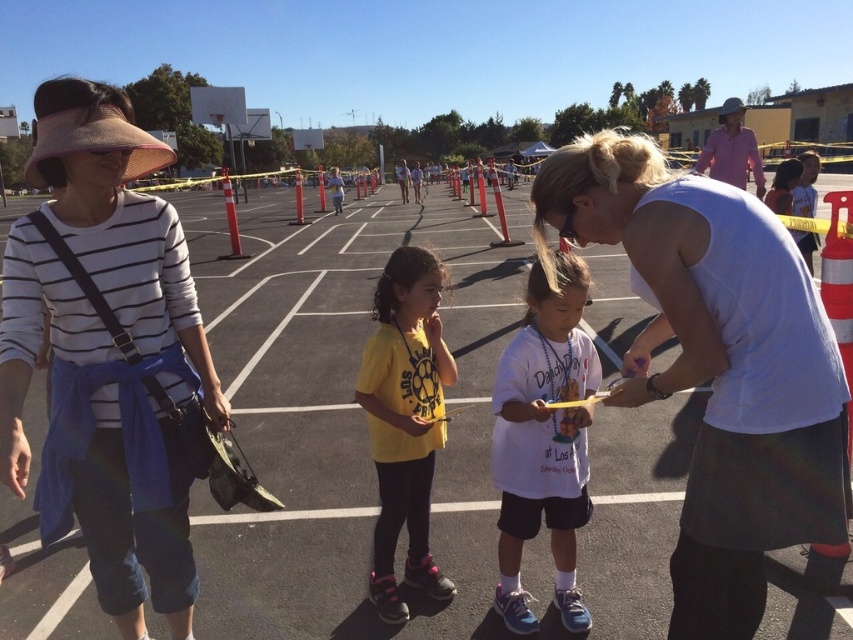
Between asphalt at center and matte striped shirt at left, which one appears on the right side from the viewer's perspective?

Positioned to the right is asphalt at center.

Is asphalt at center above matte striped shirt at left?

Indeed, asphalt at center is positioned over matte striped shirt at left.

You are a GUI agent. You are given a task and a screenshot of the screen. Output one action in this format:
    pyautogui.click(x=<x>, y=<y>)
    Task: Click on the asphalt at center
    This screenshot has width=853, height=640.
    Given the screenshot: What is the action you would take?
    pyautogui.click(x=341, y=413)

Which of these two, asphalt at center or white cotton shirt at center, stands taller?

A: asphalt at center

Is asphalt at center thinner than white cotton shirt at center?

No, asphalt at center is not thinner than white cotton shirt at center.

Who is more distant from viewer, (547, 586) or (712, 200)?

Point (547, 586)

You are a GUI agent. You are given a task and a screenshot of the screen. Output one action in this format:
    pyautogui.click(x=<x>, y=<y>)
    Task: Click on the asphalt at center
    The image size is (853, 640).
    Given the screenshot: What is the action you would take?
    [341, 413]

Who is higher up, white matte shirt at center or yellow matte shirt at center?

Positioned higher is yellow matte shirt at center.

Does point (543, 276) lie in front of point (436, 593)?

Yes, point (543, 276) is closer to viewer.

At what (x,y) coordinates should I click in order to perform the action: click on white matte shirt at center. Please return your answer as a coordinate pair (x, y). The width and height of the screenshot is (853, 640). Looking at the image, I should click on (543, 440).

Where is `white matte shirt at center`? The height and width of the screenshot is (640, 853). white matte shirt at center is located at coordinates (543, 440).